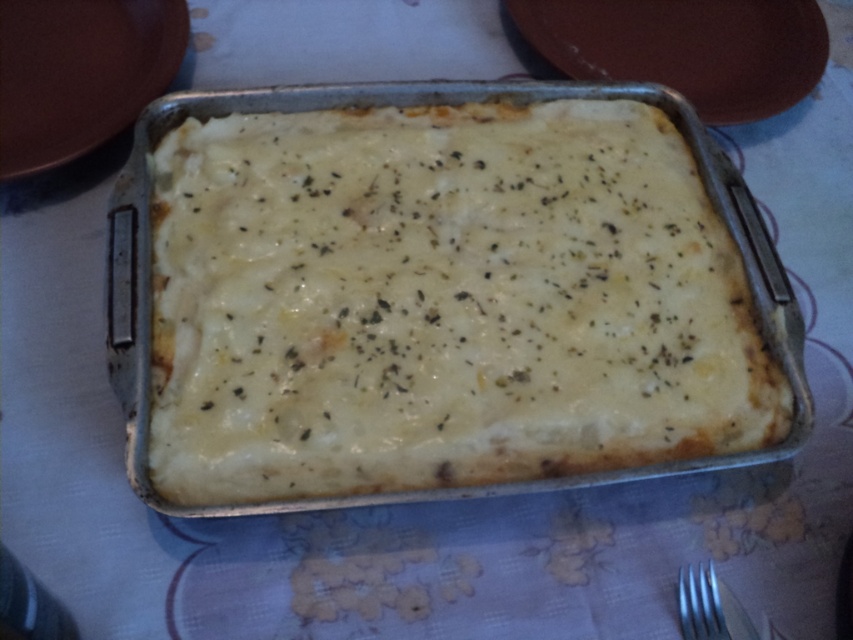
Does point (670, 312) lie behind point (805, 65)?

No, (670, 312) is in front of (805, 65).

The height and width of the screenshot is (640, 853). What do you see at coordinates (442, 301) in the screenshot?
I see `white creamy casserole at center` at bounding box center [442, 301].

Find the location of a particular element. This screenshot has width=853, height=640. white creamy casserole at center is located at coordinates (442, 301).

The width and height of the screenshot is (853, 640). I want to click on white creamy casserole at center, so click(442, 301).

Which is behind, point (657, 67) or point (16, 4)?

The point (657, 67) is behind.

This screenshot has height=640, width=853. Describe the element at coordinates (686, 48) in the screenshot. I see `matte brown platter at upper right` at that location.

The width and height of the screenshot is (853, 640). Identify the location of matte brown platter at upper right. (686, 48).

Does matte brown platter at upper right appear on the left side of silver metallic fork at lower right?

No, matte brown platter at upper right is not to the left of silver metallic fork at lower right.

Can you confirm if matte brown platter at upper right is positioned to the right of silver metallic fork at lower right?

Correct, you'll find matte brown platter at upper right to the right of silver metallic fork at lower right.

Does point (714, 93) lie behind point (727, 611)?

Yes, point (714, 93) is farther from viewer.

Image resolution: width=853 pixels, height=640 pixels. I want to click on matte brown platter at upper right, so click(x=686, y=48).